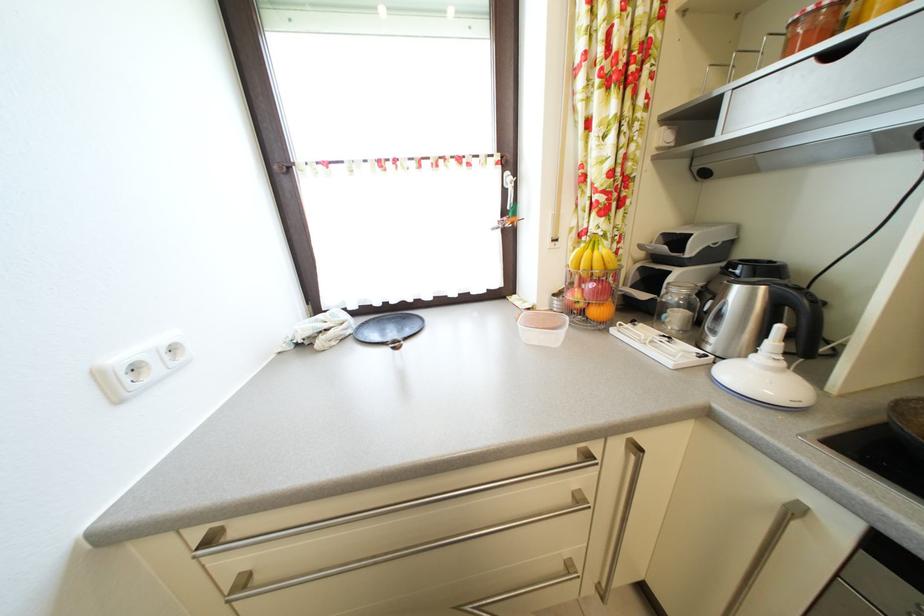
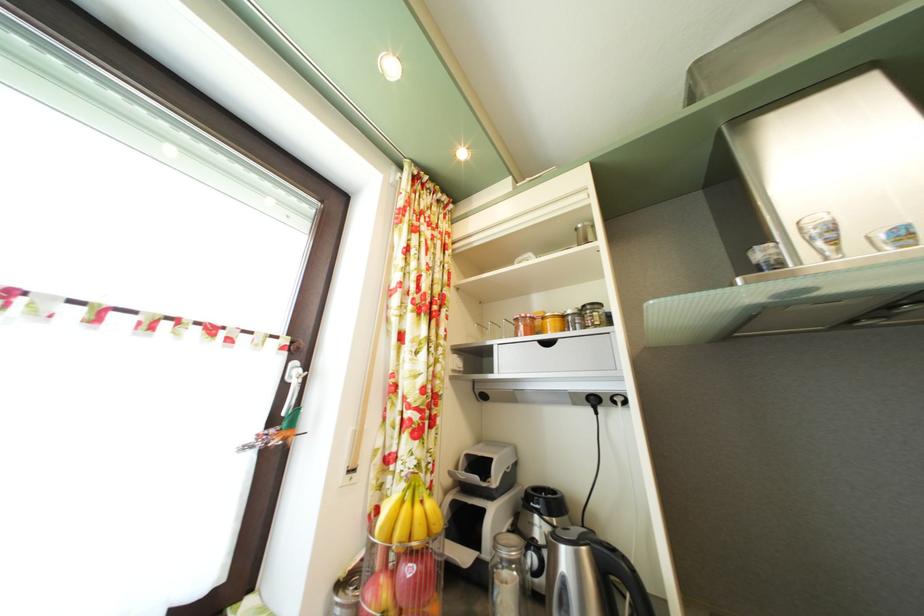
Where in the second image is the point corresponding to the point at 603,261 from the first image?

(426, 516)